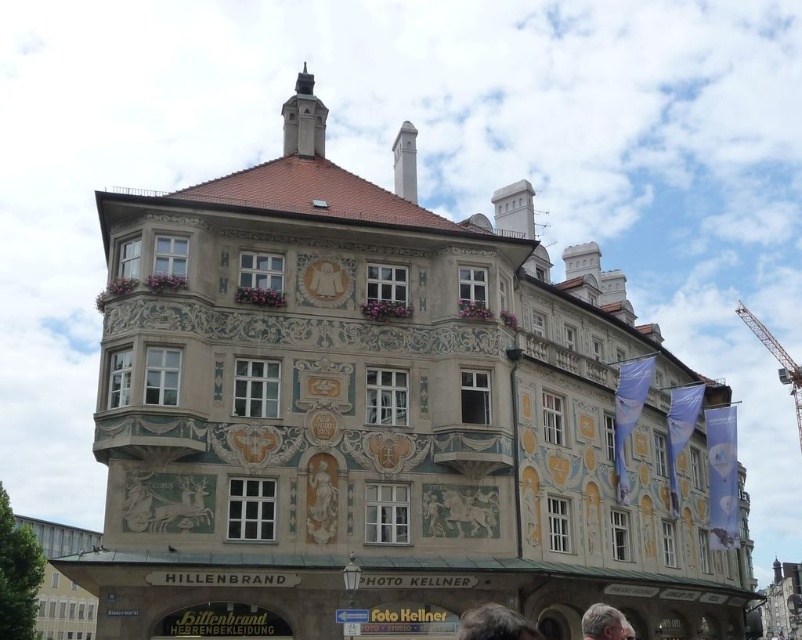
Does point (462, 637) lie in front of point (608, 609)?

Yes, point (462, 637) is in front of point (608, 609).

Does gray hair at lower center appear under gray hair at lower right?

No.

What do you see at coordinates (495, 625) in the screenshot? I see `gray hair at lower center` at bounding box center [495, 625].

I want to click on gray hair at lower center, so click(x=495, y=625).

Measure the distance between white marble statue at center and camera.

A distance of 136.46 feet exists between white marble statue at center and camera.

Based on the photo, is white marble statue at center positioned at the back of gray hair at lower right?

That is True.

Is point (310, 460) closer to viewer compared to point (598, 625)?

That is False.

Find the location of a particular element. This screenshot has width=802, height=640. white marble statue at center is located at coordinates (321, 490).

Does metallic gray crane at upper right have a lesser width compared to gray hair at lower right?

No, metallic gray crane at upper right is not thinner than gray hair at lower right.

Between metallic gray crane at upper right and gray hair at lower right, which one appears on the right side from the viewer's perspective?

metallic gray crane at upper right is more to the right.

Is point (751, 330) positioned behind point (604, 616)?

Yes, it is.

Where is `metallic gray crane at upper right`? This screenshot has width=802, height=640. metallic gray crane at upper right is located at coordinates (776, 358).